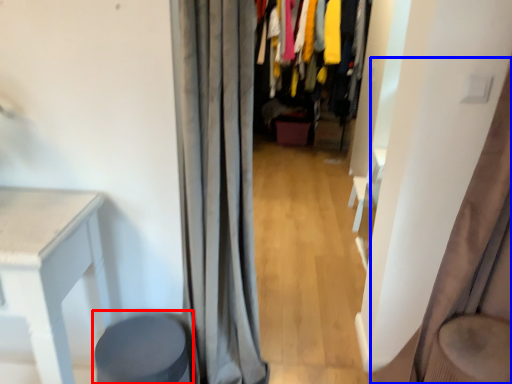
Question: Which object appears farthest to the camera in this image, music stool (highlighted by a red box) or curtain (highlighted by a blue box)?

Choices:
 (A) music stool
 (B) curtain

Answer: (A)